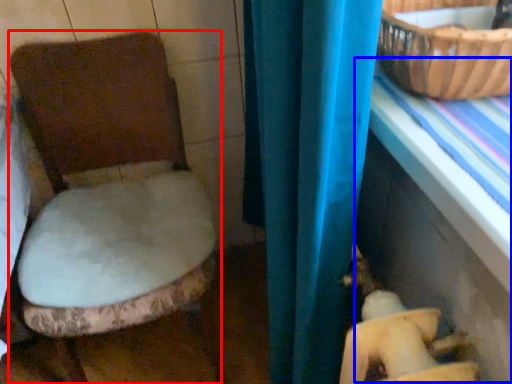
Question: Which point is closer to the camera, toilet (highlighted by a red box) or table (highlighted by a blue box)?

Choices:
 (A) toilet
 (B) table

Answer: (B)